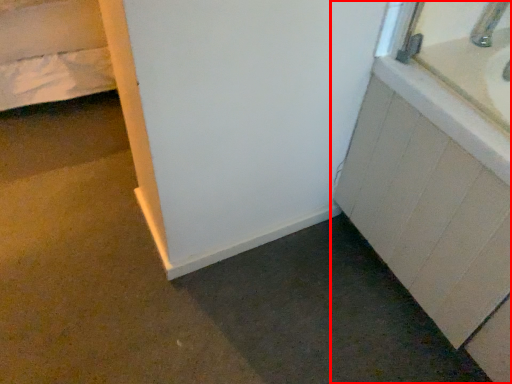
Question: From the image's perspective, what is the correct spatial positioning of bathroom cabinet (annotated by the red box) in reference to faucet?

Choices:
 (A) above
 (B) below

Answer: (B)